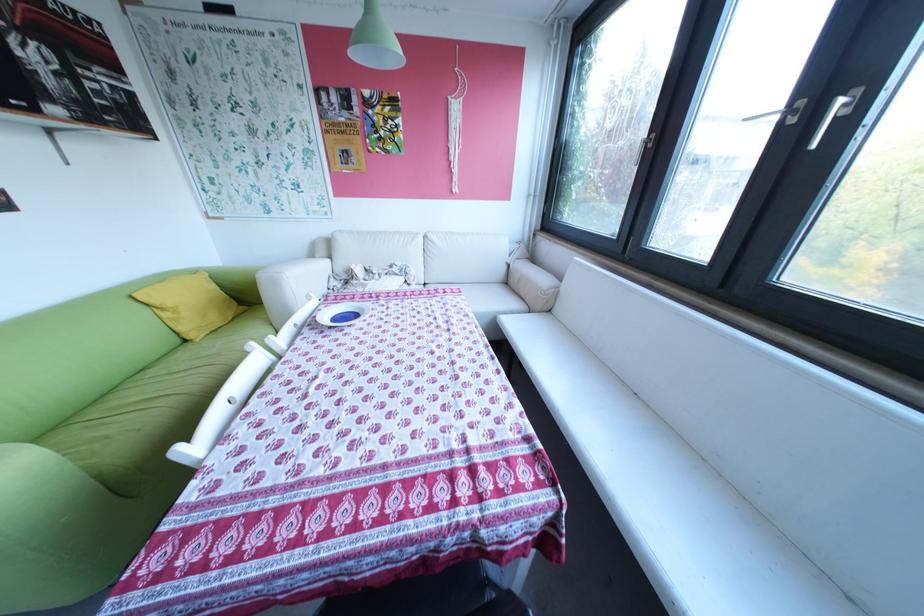
Find the location of a particular element. This screenshot has height=616, width=924. white bench surface is located at coordinates (674, 499).